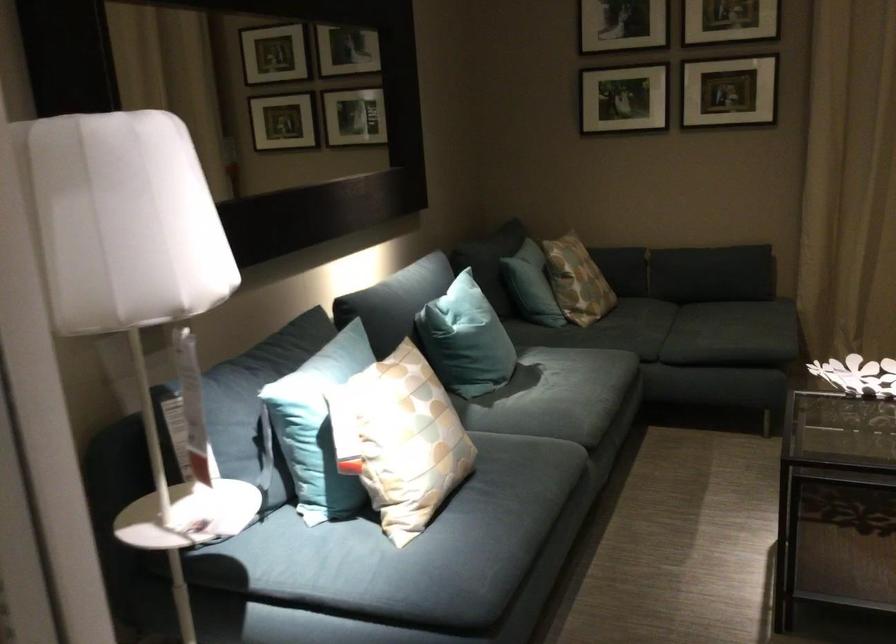
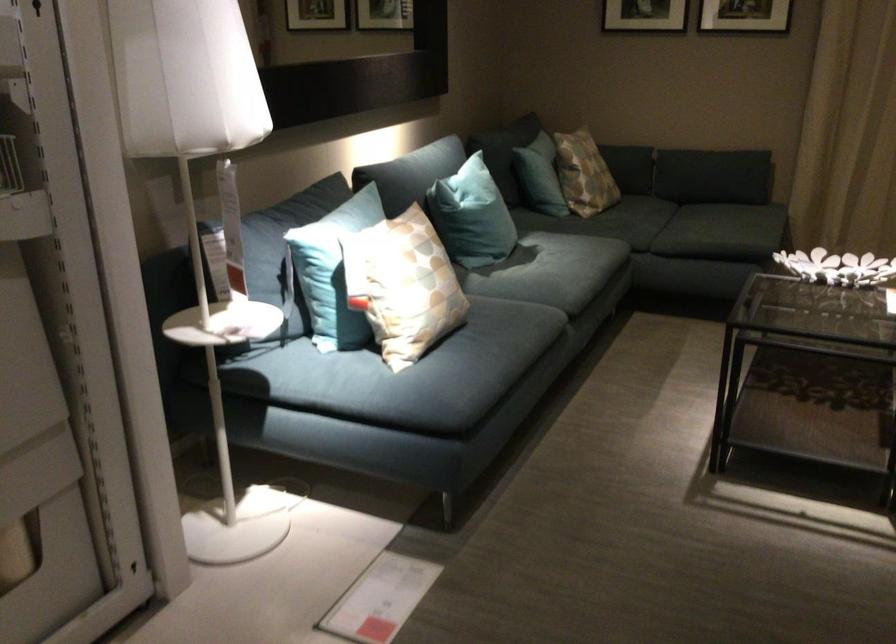
In the second image, find the point that corresponds to (x=400, y=442) in the first image.

(402, 285)